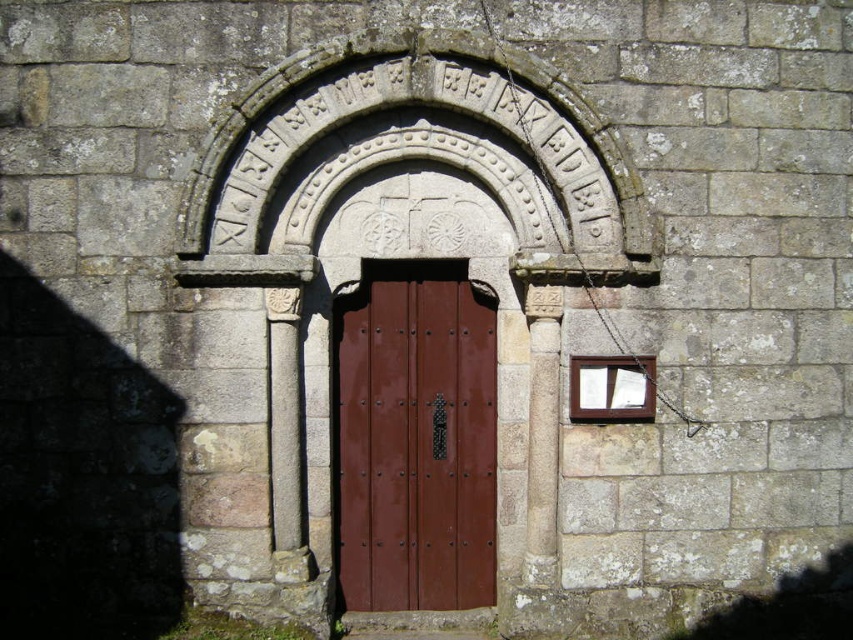
Does carved stone arch at center appear under wooden window at right?

No.

Can you confirm if carved stone arch at center is positioned to the right of wooden window at right?

No, carved stone arch at center is not to the right of wooden window at right.

Who is more distant from viewer, (x=271, y=257) or (x=630, y=417)?

The point (x=630, y=417) is behind.

At what (x,y) coordinates should I click in order to perform the action: click on carved stone arch at center. Please return your answer as a coordinate pair (x, y). The width and height of the screenshot is (853, 640). Looking at the image, I should click on (415, 157).

Who is lower down, carved stone arch at center or brown polished wood door at center?

brown polished wood door at center is lower down.

Describe the element at coordinates (415, 157) in the screenshot. I see `carved stone arch at center` at that location.

You are a GUI agent. You are given a task and a screenshot of the screen. Output one action in this format:
    pyautogui.click(x=<x>, y=<y>)
    Task: Click on the carved stone arch at center
    
    Given the screenshot: What is the action you would take?
    pyautogui.click(x=415, y=157)

Is point (370, 268) less distant than point (614, 396)?

No, (370, 268) is behind (614, 396).

Locate an element on the screen. brown polished wood door at center is located at coordinates (415, 438).

Is point (376, 296) positioned behind point (630, 362)?

Yes, it is.

You are a GUI agent. You are given a task and a screenshot of the screen. Output one action in this format:
    pyautogui.click(x=<x>, y=<y>)
    Task: Click on the brown polished wood door at center
    The width and height of the screenshot is (853, 640).
    Given the screenshot: What is the action you would take?
    pyautogui.click(x=415, y=438)